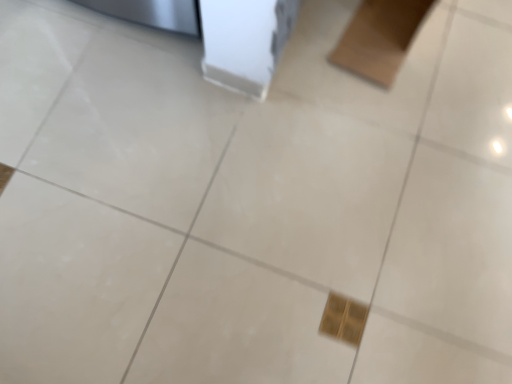
The image size is (512, 384). What do you see at coordinates (379, 38) in the screenshot?
I see `wooden block at upper right` at bounding box center [379, 38].

At what (x,y) coordinates should I click in order to perform the action: click on wooden block at upper right. Please return your answer as a coordinate pair (x, y). This screenshot has height=384, width=512. Looking at the image, I should click on (379, 38).

The image size is (512, 384). I want to click on wooden block at upper right, so (x=379, y=38).